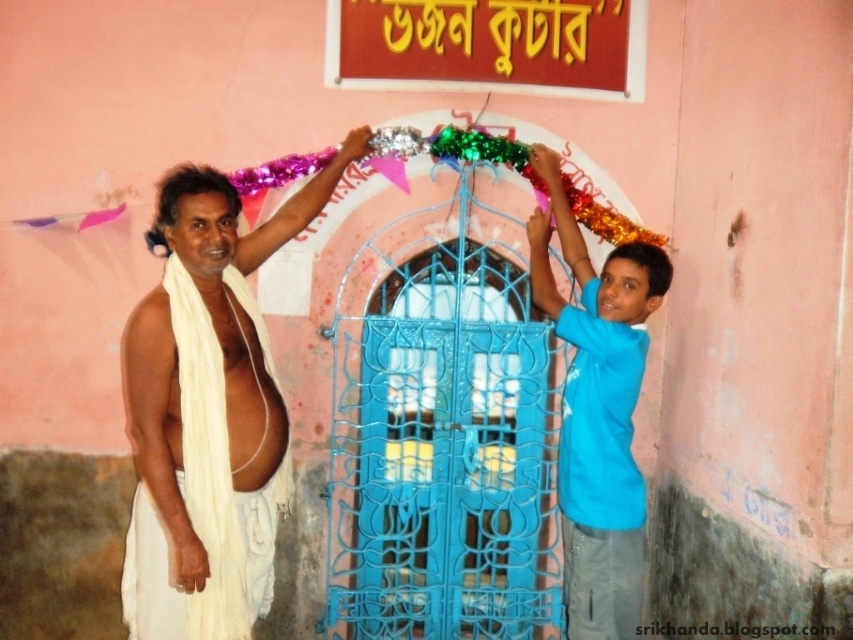
Question: Which point appears farthest from the camera in this image?

Choices:
 (A) (448, 234)
 (B) (166, 532)
 (C) (579, 324)

Answer: (A)

Question: Is blue metallic gate at center positioned before white clothed man at left?

Choices:
 (A) no
 (B) yes

Answer: (A)

Question: Observing the image, what is the correct spatial positioning of blue t-shirt at right in reference to white cloth at right?

Choices:
 (A) right
 (B) left

Answer: (B)

Question: Which point is farther from the camera taking this photo?

Choices:
 (A) click(573, 566)
 (B) click(361, 536)
 (C) click(149, 384)

Answer: (B)

Question: Estimate the real-world distances between objects in this image. Which object is farther from the blue t-shirt at right?

Choices:
 (A) white cloth at left
 (B) white clothed man at left
 (C) blue metallic gate at center

Answer: (A)

Question: Is blue metallic gate at center positioned before white cloth at right?

Choices:
 (A) no
 (B) yes

Answer: (A)